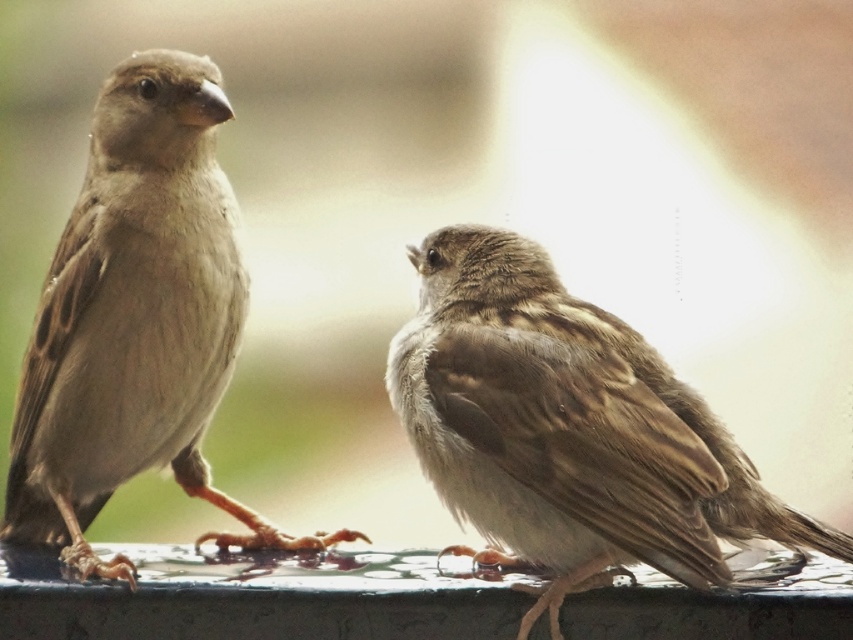
Can you confirm if brown feathered sparrow at center is wider than brown feathered sparrow at left?

Indeed, brown feathered sparrow at center has a greater width compared to brown feathered sparrow at left.

Is point (523, 561) positioned before point (184, 404)?

Yes, point (523, 561) is closer to viewer.

The width and height of the screenshot is (853, 640). Describe the element at coordinates (567, 428) in the screenshot. I see `brown feathered sparrow at center` at that location.

Where is `brown feathered sparrow at center`? This screenshot has width=853, height=640. brown feathered sparrow at center is located at coordinates coord(567,428).